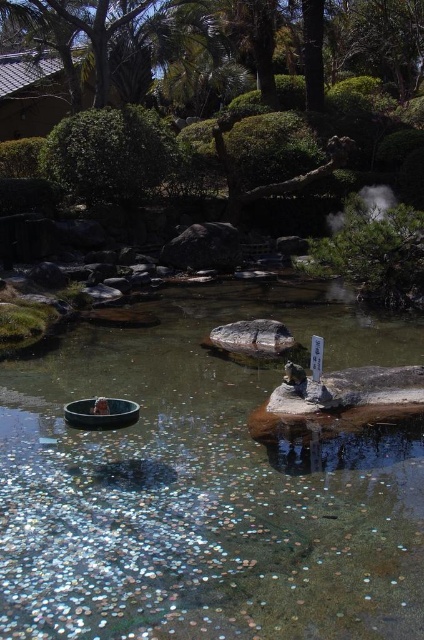
Is dark gray rock at center thinner than smooth gray rock at center?

Incorrect, dark gray rock at center's width is not less than smooth gray rock at center's.

Does dark gray rock at center come behind smooth gray rock at center?

Yes, it is behind smooth gray rock at center.

Between point (228, 262) and point (239, 339), which one is positioned in front?

Positioned in front is point (239, 339).

You are a GUI agent. You are given a task and a screenshot of the screen. Output one action in this format:
    pyautogui.click(x=<x>, y=<y>)
    Task: Click on the dark gray rock at center
    The image size is (424, 640).
    Given the screenshot: What is the action you would take?
    pyautogui.click(x=203, y=248)

Image resolution: width=424 pixels, height=640 pixels. What do you see at coordinates (203, 248) in the screenshot? I see `dark gray rock at center` at bounding box center [203, 248].

Is dark gray rock at center taller than white vapor at upper right?

Incorrect, dark gray rock at center's height is not larger of white vapor at upper right's.

Locate an element on the screen. dark gray rock at center is located at coordinates (203, 248).

At what (x,y) coordinates should I click in order to perform the action: click on dark gray rock at center. Please return your answer as a coordinate pair (x, y). Looking at the image, I should click on (203, 248).

From the picture: Who is higher up, smooth gray rock at center or white vapor at upper right?

white vapor at upper right

Is point (239, 352) farther from viewer compared to point (340, 221)?

No, (239, 352) is closer to viewer.

Locate an element on the screen. The width and height of the screenshot is (424, 640). smooth gray rock at center is located at coordinates (x=253, y=337).